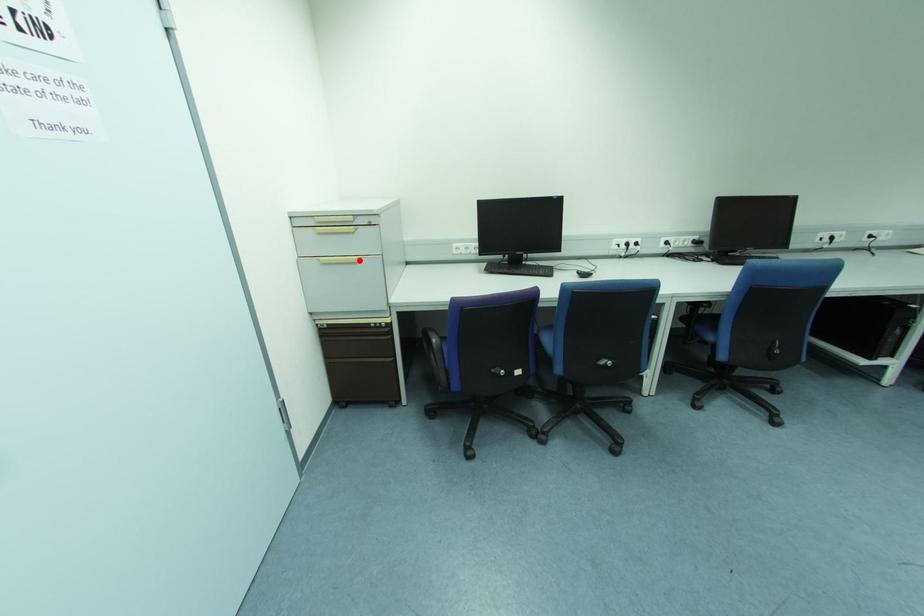
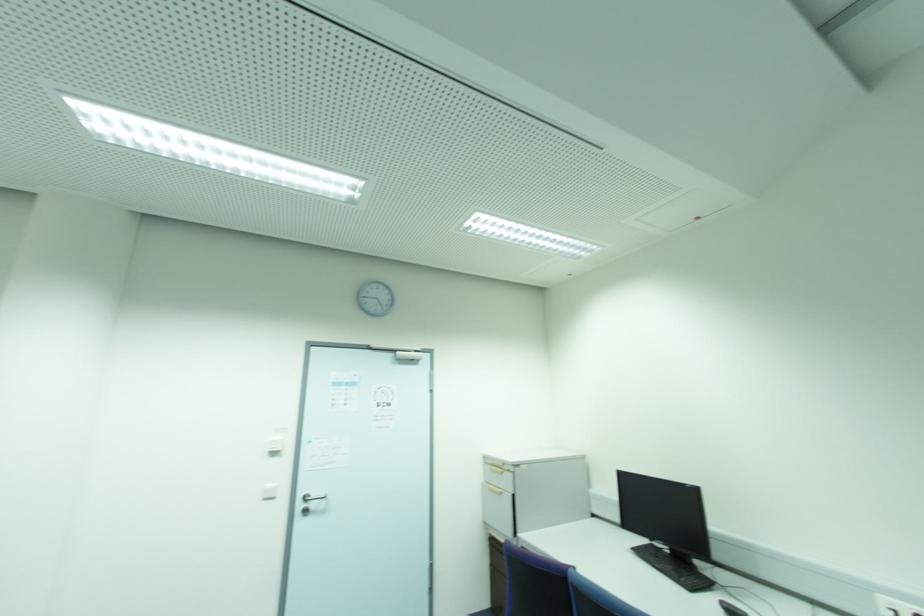
Question: I am providing you with two images of the same scene from different viewpoints. A red point is shown in image1. For the corresponding object point in image2, is it positioned nearer or farther from the camera?

Choices:
 (A) Nearer
 (B) Farther

Answer: (B)